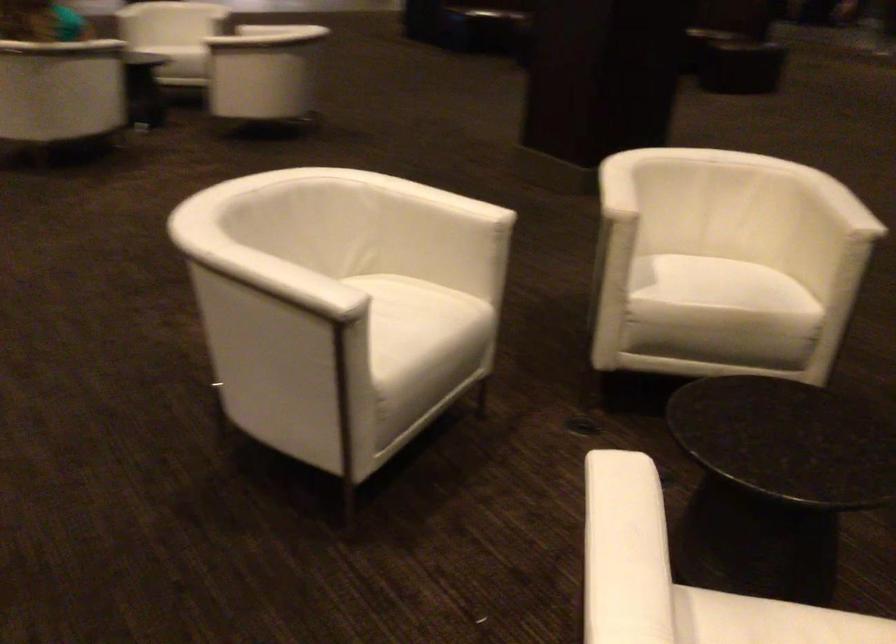
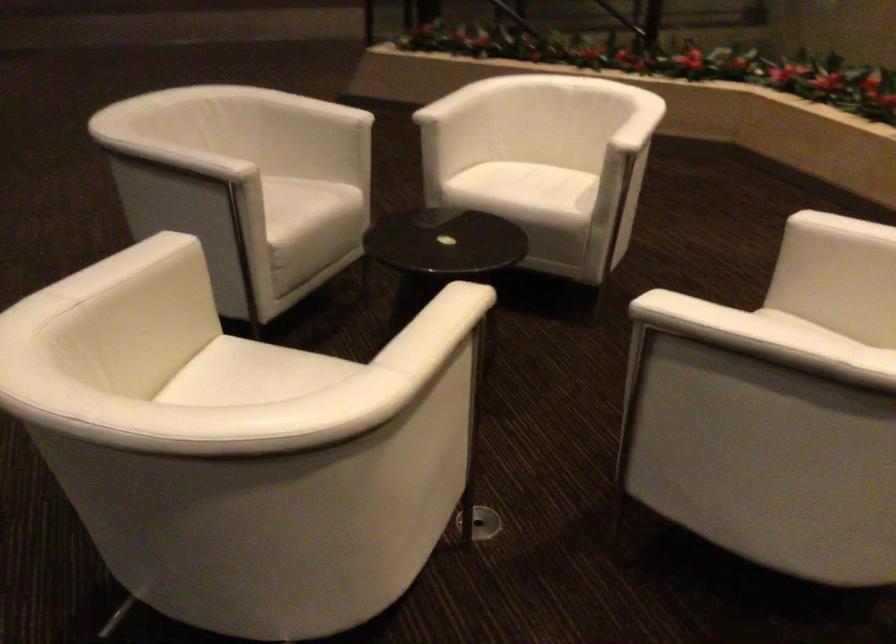
The point at (760, 281) is marked in the first image. Where is the corresponding point in the second image?

(252, 375)